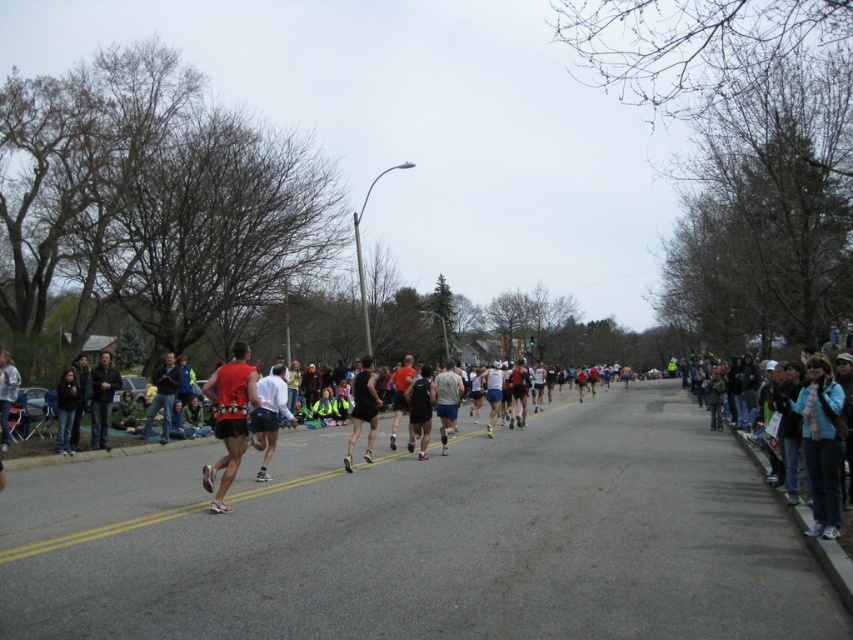
Question: In this image, where is dark gray jacket at left located relative to black fabric backpack at center?

Choices:
 (A) right
 (B) left

Answer: (B)

Question: Is denim jacket at left below matte black shorts at center?

Choices:
 (A) no
 (B) yes

Answer: (B)

Question: Can you confirm if dark blue jeans at left is positioned to the right of black fabric backpack at center?

Choices:
 (A) yes
 (B) no

Answer: (B)

Question: Which object is closer to the camera taking this photo?

Choices:
 (A) matte red tank top at center
 (B) dark blue jeans at left

Answer: (A)

Question: Considering the real-world distances, which object is farthest from the blue fleece jacket at right?

Choices:
 (A) denim jacket at left
 (B) black matte tank top at center
 (C) black fabric backpack at center
 (D) dark gray jacket at left

Answer: (D)

Question: Among these points, which one is nearest to the camera?

Choices:
 (A) (805, 412)
 (B) (370, 372)
 (C) (451, 403)

Answer: (A)